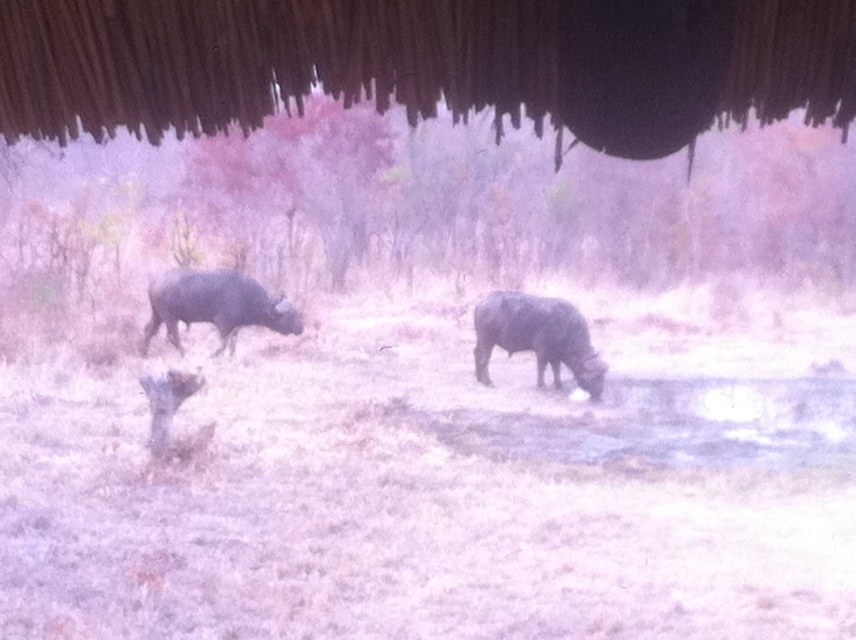
Between dark gray matte yak at center and dark gray matte yak at left, which one is positioned higher?

dark gray matte yak at left is above.

This screenshot has height=640, width=856. In order to click on dark gray matte yak at center in this screenshot , I will do `click(536, 337)`.

At what (x,y) coordinates should I click in order to perform the action: click on dark gray matte yak at center. Please return your answer as a coordinate pair (x, y). The height and width of the screenshot is (640, 856). Looking at the image, I should click on (536, 337).